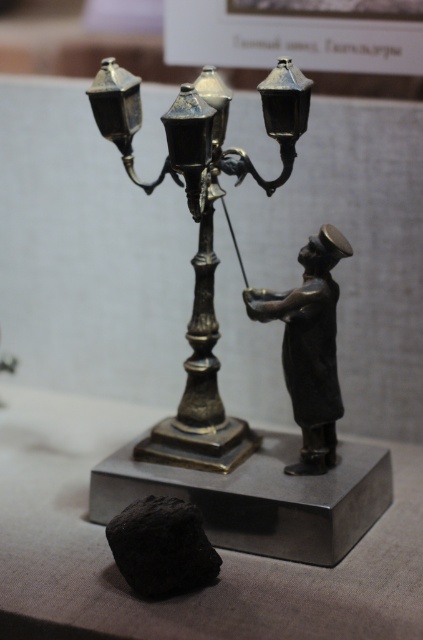
Who is more forward, (180, 122) or (301, 396)?

Point (180, 122)

Which of these two, polished brass lamp at center or bronze figurine at right, stands shorter?

bronze figurine at right is shorter.

Between point (236, 433) and point (334, 305), which one is positioned in front?

Point (334, 305) is more forward.

At what (x,y) coordinates should I click in order to perform the action: click on polished brass lamp at center. Please return your answer as a coordinate pair (x, y). The image size is (423, 640). Looking at the image, I should click on (200, 232).

Does bronze figurine at right have a lesser width compared to black matte rock at lower left?

Yes.

Does bronze figurine at right appear over black matte rock at lower left?

Indeed, bronze figurine at right is positioned over black matte rock at lower left.

Does point (324, 321) lie in front of point (145, 500)?

No, (324, 321) is further to viewer.

Find the location of `bronze figurine at right`. bronze figurine at right is located at coordinates (310, 346).

Measure the distance between polished brass lamp at center and camera.

They are 4.01 feet apart.

Can you confirm if polished brass lamp at center is positioned to the left of black matte rock at lower left?

In fact, polished brass lamp at center is to the right of black matte rock at lower left.

Is point (205, 308) positioned before point (142, 561)?

No, it is behind (142, 561).

Where is `polished brass lamp at center`? polished brass lamp at center is located at coordinates (200, 232).